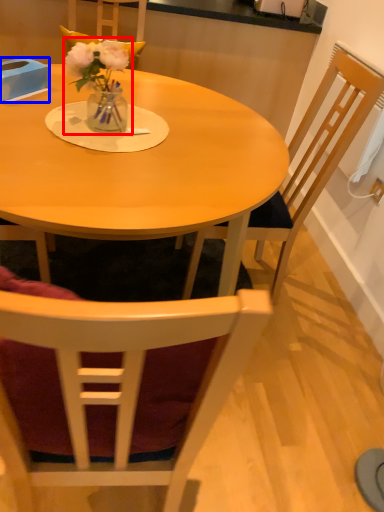
Question: Among these objects, which one is farthest to the camera, floral arrangement (highlighted by a red box) or box (highlighted by a blue box)?

Choices:
 (A) floral arrangement
 (B) box

Answer: (B)